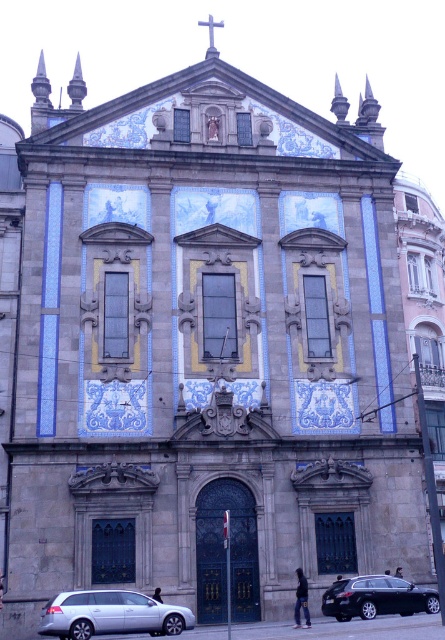
Who is positioned more to the left, silver metallic car at lower left or shiny black sedan at lower center?

silver metallic car at lower left

Which is in front, point (110, 620) or point (400, 609)?

Positioned in front is point (110, 620).

What are the coordinates of `silver metallic car at lower left` in the screenshot? It's located at (110, 614).